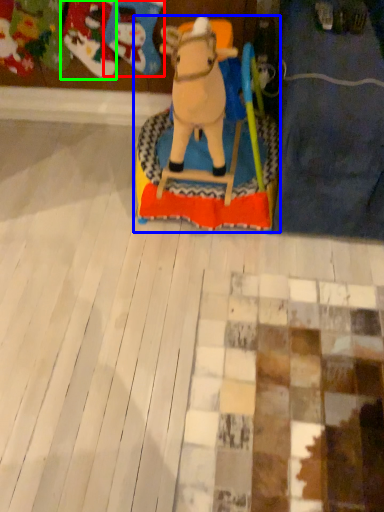
Question: Based on their relative distances, which object is farther from toy (highlighted by a red box)? Choose from toy (highlighted by a blue box) and toy (highlighted by a green box).

Choices:
 (A) toy
 (B) toy

Answer: (A)